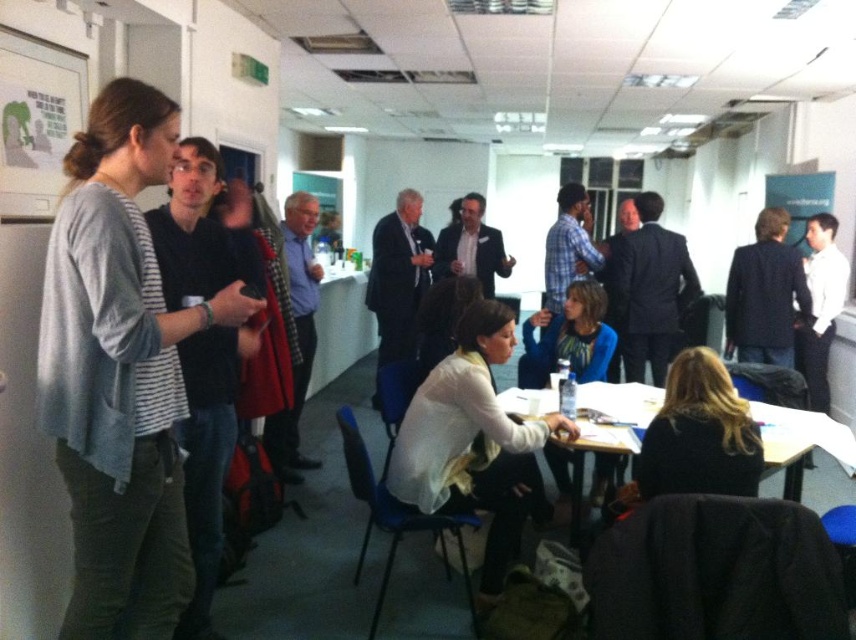
Which is more to the right, light gray sweater at left or blue fabric jacket at center?

blue fabric jacket at center is more to the right.

Is light gray sweater at left above blue fabric jacket at center?

Incorrect, light gray sweater at left is not positioned above blue fabric jacket at center.

In order to click on light gray sweater at left in this screenshot , I will do `click(120, 371)`.

Is light gray sweater at left behind wooden table at lower right?

No, light gray sweater at left is in front of wooden table at lower right.

This screenshot has height=640, width=856. Describe the element at coordinates (120, 371) in the screenshot. I see `light gray sweater at left` at that location.

Find the location of a particular element. Image resolution: width=856 pixels, height=640 pixels. light gray sweater at left is located at coordinates (120, 371).

Does white soft sweater at center have a smaller size compared to dark brown hair at lower right?

Actually, white soft sweater at center might be larger than dark brown hair at lower right.

Who is more forward, (504, 454) or (667, 451)?

Point (667, 451) is more forward.

The image size is (856, 640). I want to click on white soft sweater at center, so click(x=473, y=442).